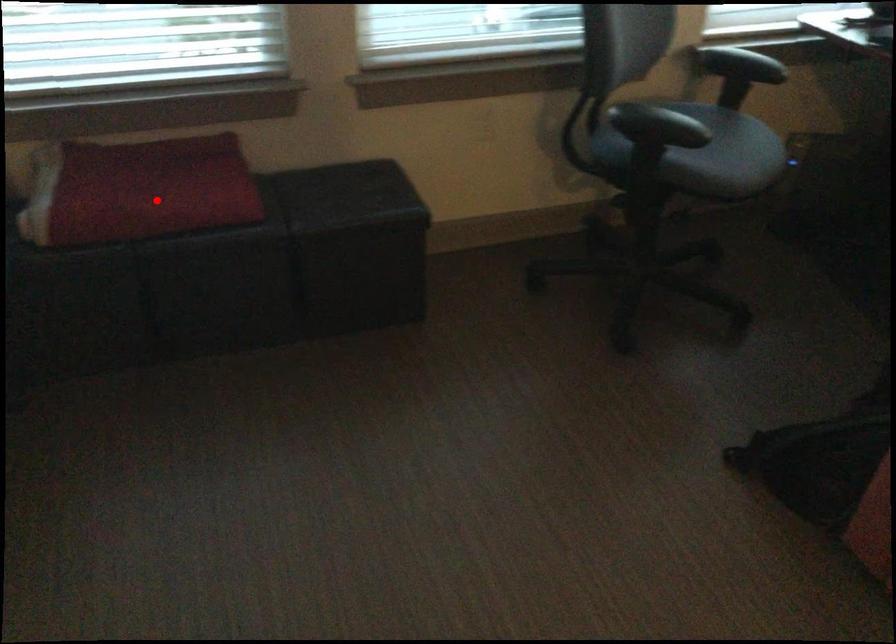
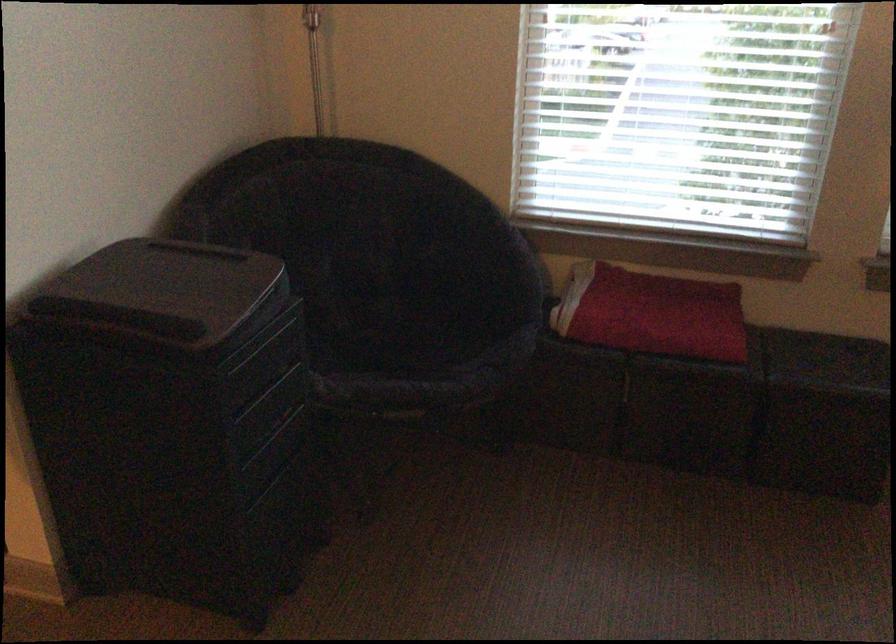
Question: I am providing you with two images of the same scene from different viewpoints. Image1 has a red point marked. In image2, the corresponding 3D location appears at what relative position? Reply with the corresponding letter.

Choices:
 (A) Closer
 (B) Farther

Answer: (B)